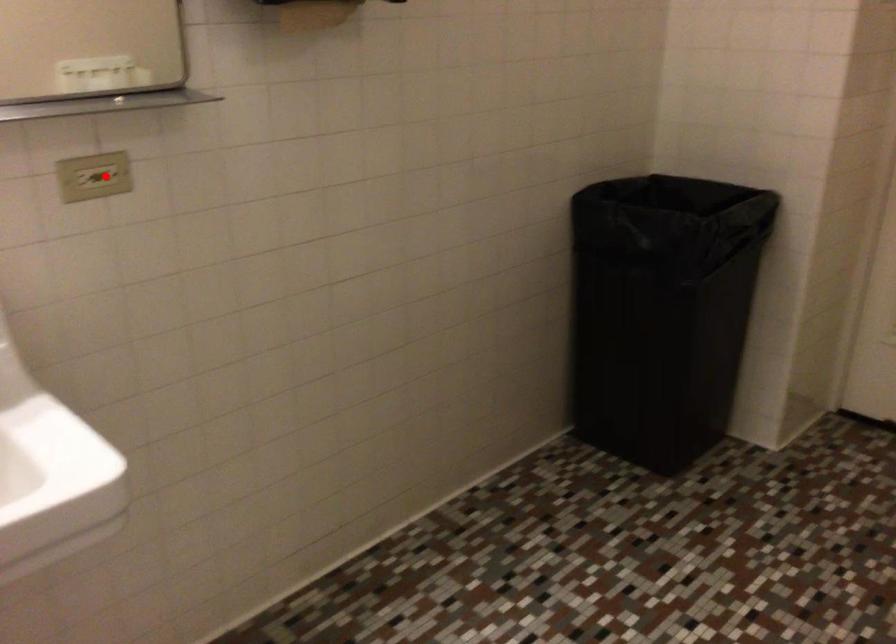
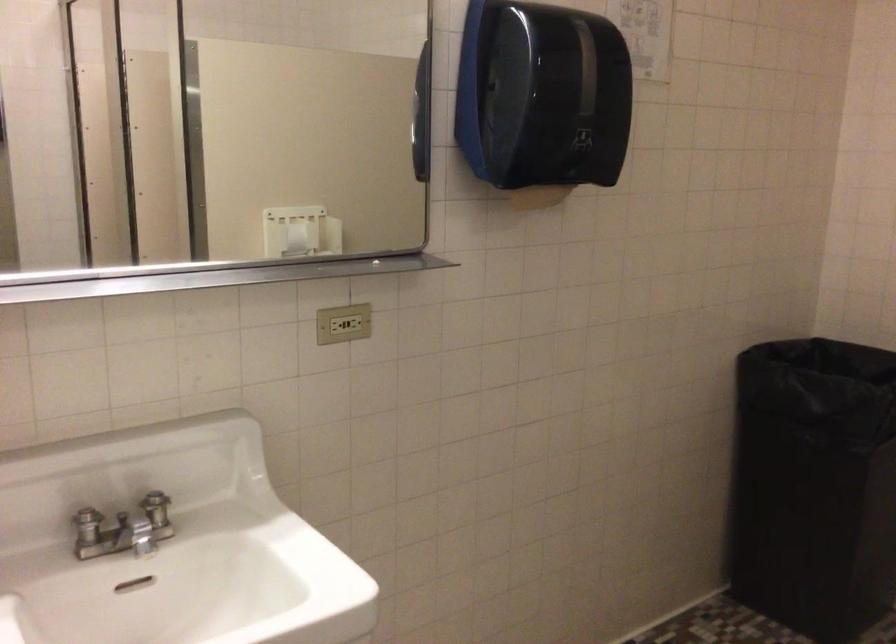
Question: A red point is marked in image1. In image2, is the corresponding 3D point closer to the camera or farther? Reply with the corresponding letter.

Choices:
 (A) The corresponding 3D point is closer.
 (B) The corresponding 3D point is farther.

Answer: (B)